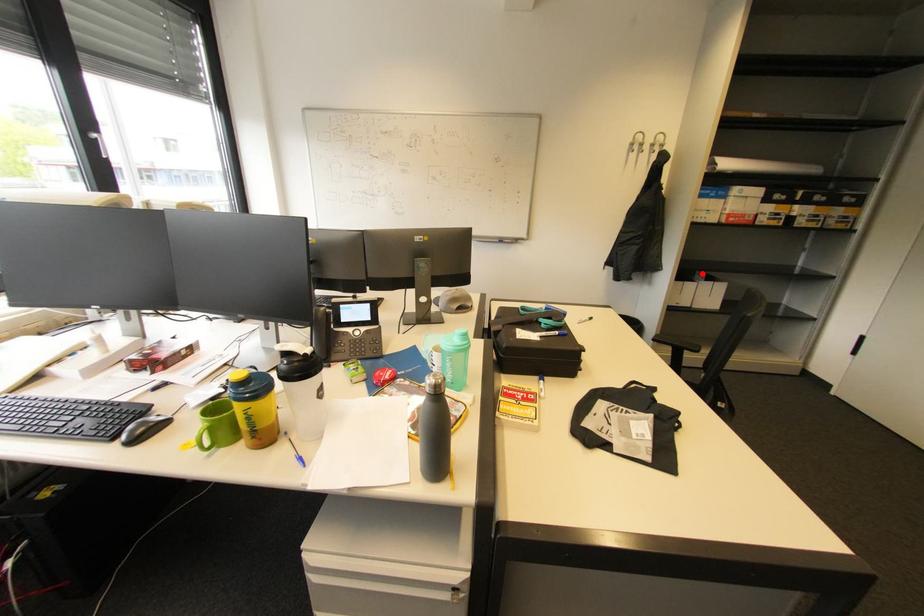
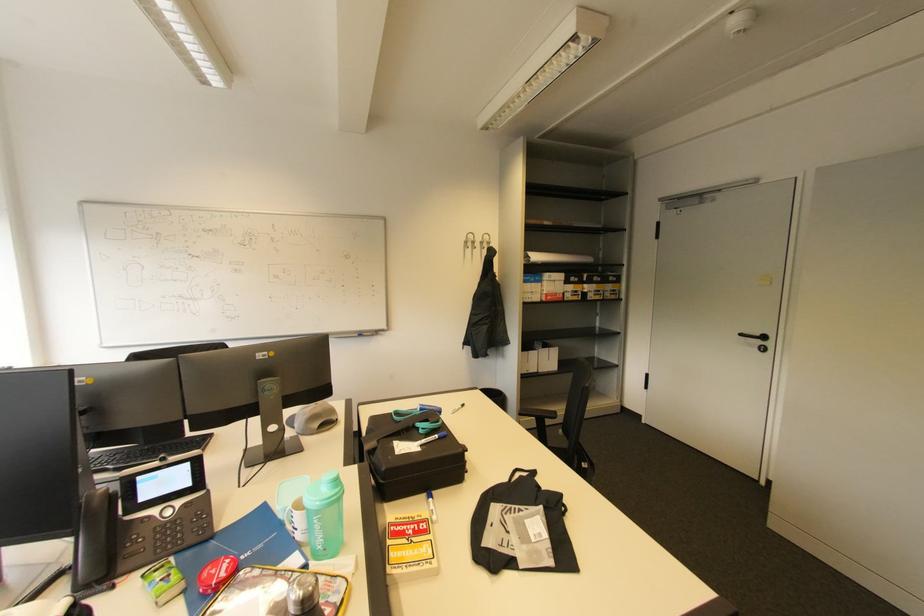
Find the pixel in the second image that matches the highlighted location in the first image.

(541, 342)